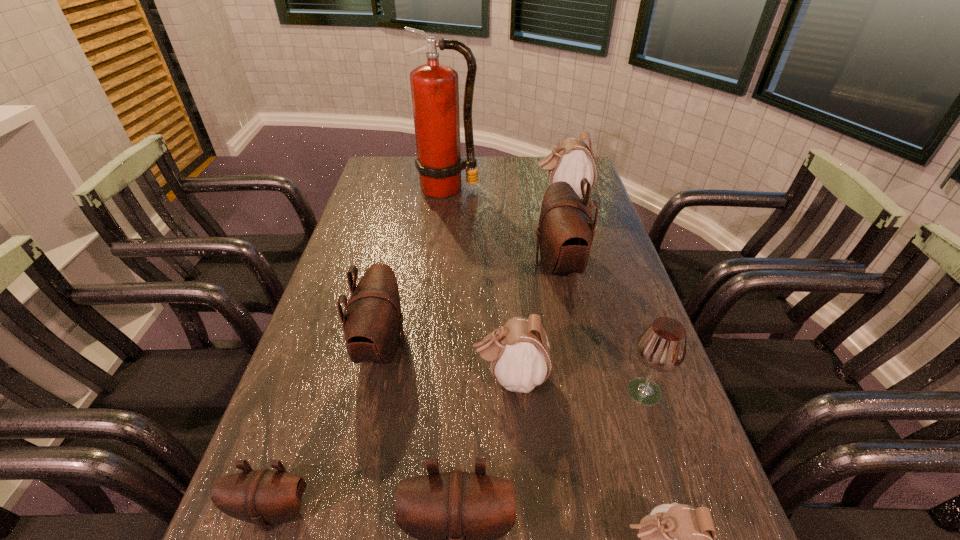
This screenshot has width=960, height=540. Find the location of `the smallest brown pouch`. the smallest brown pouch is located at coordinates (265, 497).

You are a GUI agent. You are given a task and a screenshot of the screen. Output one action in this format:
    pyautogui.click(x=<x>, y=<y>)
    Task: Click on the free location located 0.340m at the nozzle of the tallest object
    
    Given the screenshot: What is the action you would take?
    pyautogui.click(x=440, y=264)

Where is `vacant space situated with the flap open on the rightmost brown pouch`? This screenshot has height=540, width=960. vacant space situated with the flap open on the rightmost brown pouch is located at coordinates (481, 265).

Locate an element on the screen. The image size is (960, 540). vacant area situated with the flap open on the rightmost brown pouch is located at coordinates [498, 265].

This screenshot has width=960, height=540. Identify the location of free spot located 0.120m with the flap open on the rightmost brown pouch. (492, 265).

I want to click on vacant point located on the front-facing side of the farthest white pouch, so coord(516,196).

I want to click on free space located on the front-facing side of the farthest white pouch, so tap(418, 196).

Where is `vacant point located 0.270m on the front-facing side of the farthest white pouch`? Image resolution: width=960 pixels, height=540 pixels. vacant point located 0.270m on the front-facing side of the farthest white pouch is located at coordinates (455, 196).

In order to click on vacant area situated 0.130m with the flap open on the second biggest brown pouch in this screenshot , I will do `click(463, 346)`.

This screenshot has width=960, height=540. I want to click on vacant space located on the back of the wineglass, so click(x=610, y=288).